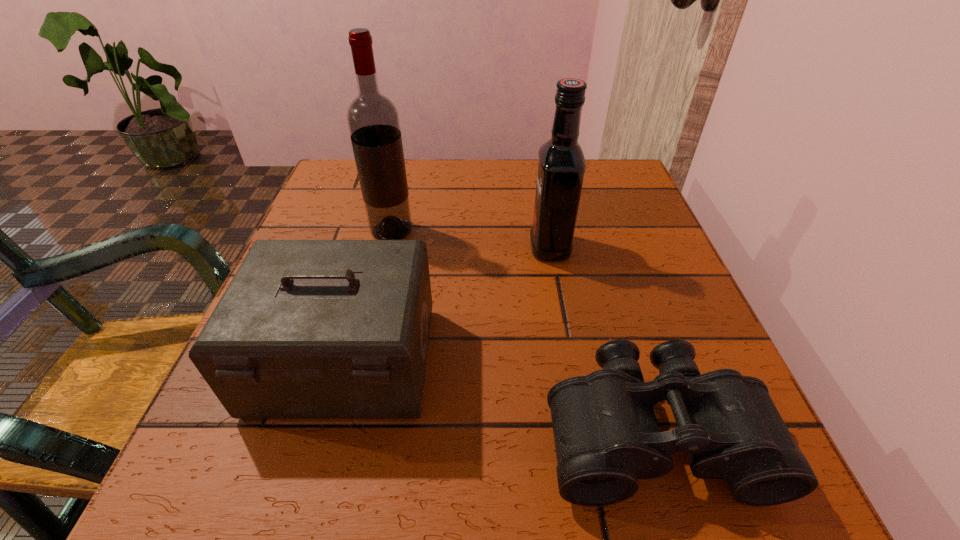
Where is `wine bottle that is at the left edge`? wine bottle that is at the left edge is located at coordinates (373, 120).

Find the location of a particular element. This screenshot has width=960, height=540. the first-aid kit positioned at the left edge is located at coordinates (307, 329).

Where is `object at the right edge`? object at the right edge is located at coordinates (606, 434).

The image size is (960, 540). What are the coordinates of `object that is positioned at the near right corner` in the screenshot? It's located at (606, 434).

Identify the location of free spot at the far edge of the desktop. (460, 214).

Where is `free space at the near edge`? free space at the near edge is located at coordinates (515, 487).

The height and width of the screenshot is (540, 960). Find the location of `free space at the left edge of the desktop`. free space at the left edge of the desktop is located at coordinates (321, 428).

I want to click on vacant area at the right edge, so pos(694,334).

Locate an element on the screen. vacant area at the far left corner of the desktop is located at coordinates (348, 204).

Locate an element on the screen. Image resolution: width=960 pixels, height=540 pixels. vacant space at the near left corner is located at coordinates (224, 464).